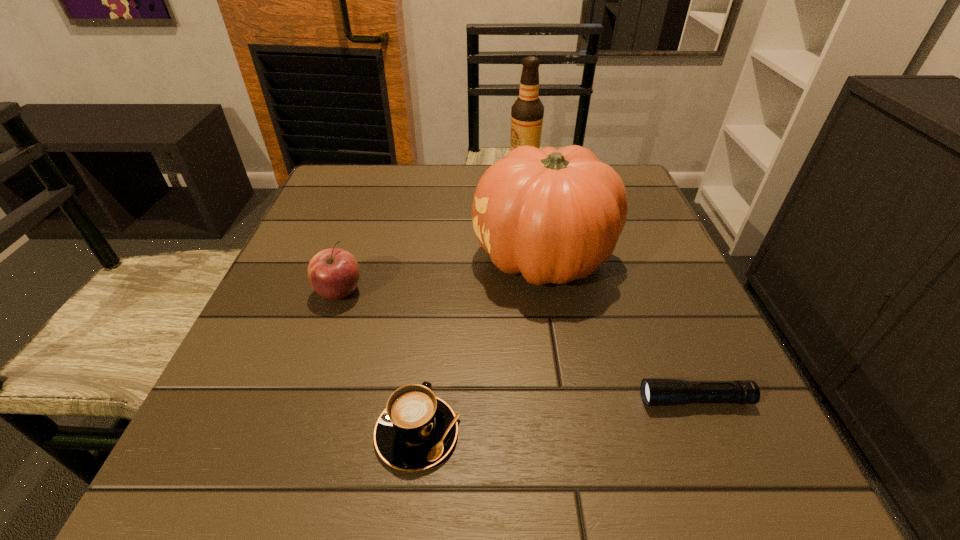
Where is `free point between the apple and the second object from left to right`? The image size is (960, 540). free point between the apple and the second object from left to right is located at coordinates (378, 363).

The width and height of the screenshot is (960, 540). Identify the location of free space between the flashlight and the pumpkin. (619, 329).

Image resolution: width=960 pixels, height=540 pixels. Find the location of `unoccupied position between the flashlight and the fourth shortest object`. unoccupied position between the flashlight and the fourth shortest object is located at coordinates (619, 329).

This screenshot has width=960, height=540. I want to click on free point between the shortest object and the apple, so click(517, 346).

Where is `vacant area between the fourth object from right to left and the fourth shortest object`? Image resolution: width=960 pixels, height=540 pixels. vacant area between the fourth object from right to left and the fourth shortest object is located at coordinates (481, 346).

Image resolution: width=960 pixels, height=540 pixels. In order to click on empty space between the cappuccino and the fourth shortest object in this screenshot , I will do `click(481, 346)`.

This screenshot has height=540, width=960. I want to click on free spot between the second shortest object and the alcohol, so click(x=470, y=304).

Where is `empty space that is in between the leftmost object and the second tallest object`? empty space that is in between the leftmost object and the second tallest object is located at coordinates (442, 275).

Identify which object is the nearest to the tallest object. Please provide its 2D coordinates. Your answer should be formatted as a tuple, i.e. [(x, y)], where the tuple contains the x and y coordinates of a point satisfying the conditions above.

[(555, 216)]

At what (x,y) coordinates should I click in order to perform the action: click on object that is the third nearest to the flashlight. Please return your answer as a coordinate pair (x, y). This screenshot has width=960, height=540. Looking at the image, I should click on (333, 273).